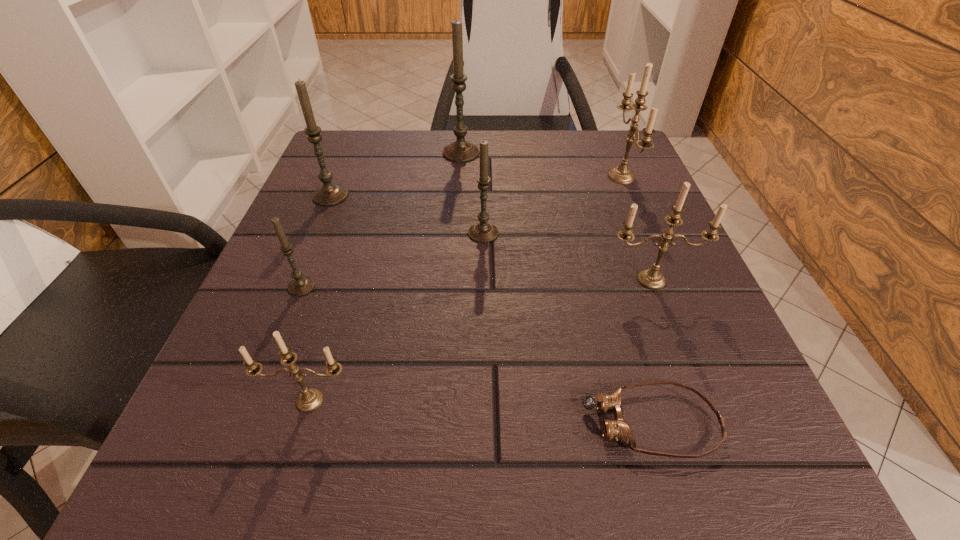
Where is `empty location between the goggles and the second biggest gray candle`? empty location between the goggles and the second biggest gray candle is located at coordinates (491, 309).

At what (x,y) coordinates should I click in order to perform the action: click on free point between the biggest metallic candle and the nearest gray candle. Please return your answer as a coordinate pair (x, y). Image resolution: width=960 pixels, height=540 pixels. Looking at the image, I should click on (462, 232).

Identify the location of the second closest object to the nearest candle. The height and width of the screenshot is (540, 960). (618, 429).

Locate an element on the screen. The width and height of the screenshot is (960, 540). the fourth closest object to the farthest gray candle is located at coordinates (652, 279).

Where is `candle identified as the closest to the biggest metallic candle`? candle identified as the closest to the biggest metallic candle is located at coordinates (652, 279).

At what (x,y) coordinates should I click in order to perform the action: click on the sixth closest candle to the fourth farthest candle. Please return your answer as a coordinate pair (x, y). The width and height of the screenshot is (960, 540). Looking at the image, I should click on (310, 399).

Where is `gray candle that is the second closest to the shortest object`? gray candle that is the second closest to the shortest object is located at coordinates (300, 286).

Identify which gray candle is the third nearest to the nearest gray candle. Please provide its 2D coordinates. Your answer should be formatted as a tuple, i.e. [(x, y)], where the tuple contains the x and y coordinates of a point satisfying the conditions above.

[(460, 150)]

Locate an element on the screen. The image size is (960, 540). the closest metallic candle relative to the farthest metallic candle is located at coordinates (652, 279).

Locate which metallic candle ranks in proximity to the biggest metallic candle. Please provide its 2D coordinates. Your answer should be formatted as a tuple, i.e. [(x, y)], where the tuple contains the x and y coordinates of a point satisfying the conditions above.

[(652, 279)]